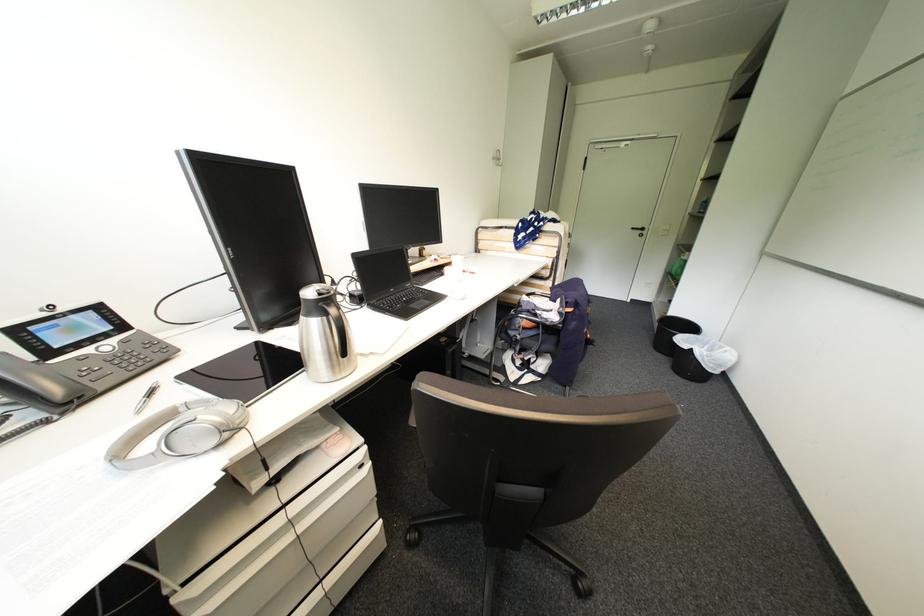
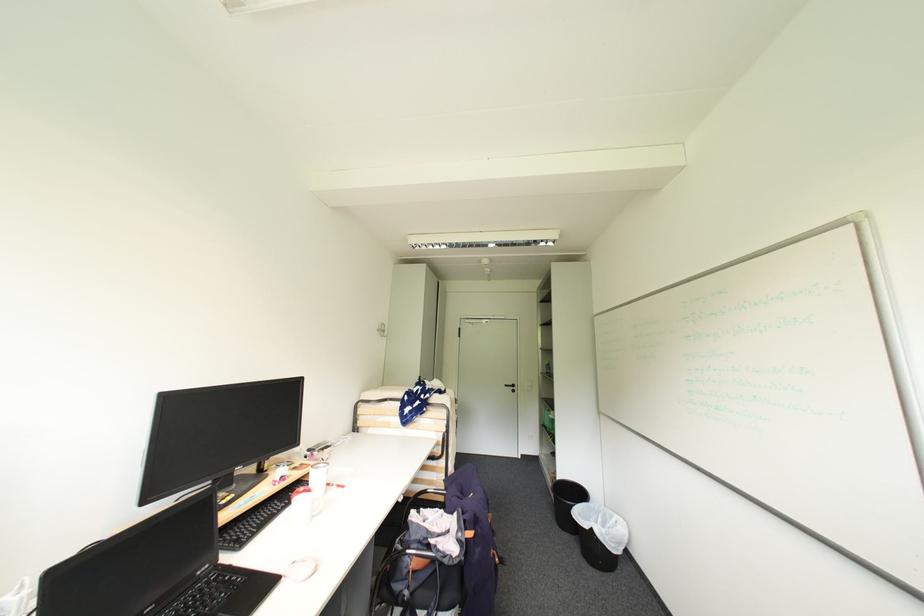
Find the pixel in the second image that matches [521,286] in the first image.

(407, 501)